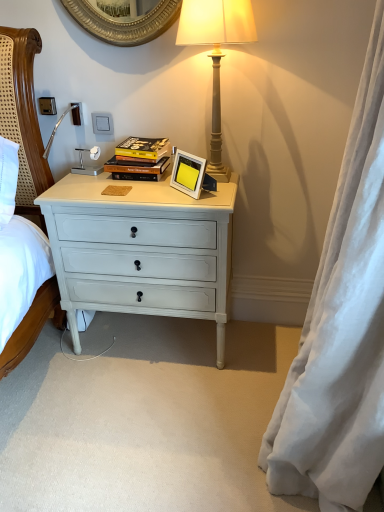
Question: Considering the relative sizes of white painted wood drawer at center and hardcover book at center in the image provided, is white painted wood drawer at center thinner than hardcover book at center?

Choices:
 (A) no
 (B) yes

Answer: (A)

Question: Is white painted wood drawer at center to the right of hardcover book at center from the viewer's perspective?

Choices:
 (A) yes
 (B) no

Answer: (A)

Question: Considering the relative positions of white painted wood drawer at center and hardcover book at center in the image provided, is white painted wood drawer at center to the left of hardcover book at center from the viewer's perspective?

Choices:
 (A) yes
 (B) no

Answer: (B)

Question: Does white painted wood drawer at center have a larger size compared to hardcover book at center?

Choices:
 (A) yes
 (B) no

Answer: (A)

Question: Is white painted wood drawer at center closer to camera compared to hardcover book at center?

Choices:
 (A) no
 (B) yes

Answer: (B)

Question: Which is correct: white plastic power outlet at upper left, arranged as the 2th power outlet when viewed from the left, is inside satin silver power outlet at upper left, which is the 1th power outlet from left to right, or outside of it?

Choices:
 (A) inside
 (B) outside

Answer: (B)

Question: Is white plastic power outlet at upper left, arranged as the second power outlet when viewed from the right, wider or thinner than satin silver power outlet at upper left, arranged as the 3th power outlet when viewed from the right?

Choices:
 (A) thin
 (B) wide

Answer: (A)

Question: Is point (74, 111) positioned closer to the camera than point (38, 98)?

Choices:
 (A) farther
 (B) closer

Answer: (A)

Question: Visually, is white plastic power outlet at upper left, arranged as the second power outlet when viewed from the right, positioned to the left or to the right of satin silver power outlet at upper left, arranged as the 3th power outlet when viewed from the right?

Choices:
 (A) left
 (B) right

Answer: (B)

Question: From their relative heights in the image, would you say hardcover book at center is taller or shorter than white plastic power outlet at upper left, arranged as the 2th power outlet when viewed from the left?

Choices:
 (A) tall
 (B) short

Answer: (A)

Question: Is hardcover book at center wider or thinner than white plastic power outlet at upper left, arranged as the second power outlet when viewed from the right?

Choices:
 (A) thin
 (B) wide

Answer: (B)

Question: Considering their positions, is hardcover book at center located in front of or behind white plastic power outlet at upper left, arranged as the second power outlet when viewed from the right?

Choices:
 (A) front
 (B) behind

Answer: (A)

Question: Is point (147, 148) positioned closer to the camera than point (77, 104)?

Choices:
 (A) closer
 (B) farther

Answer: (A)

Question: In terms of width, does white silky curtain at right look wider or thinner when compared to white plastic power outlet at upper left, arranged as the second power outlet when viewed from the right?

Choices:
 (A) wide
 (B) thin

Answer: (A)

Question: Considering the positions of white silky curtain at right and white plastic power outlet at upper left, arranged as the second power outlet when viewed from the right, in the image, is white silky curtain at right bigger or smaller than white plastic power outlet at upper left, arranged as the second power outlet when viewed from the right,?

Choices:
 (A) big
 (B) small

Answer: (A)